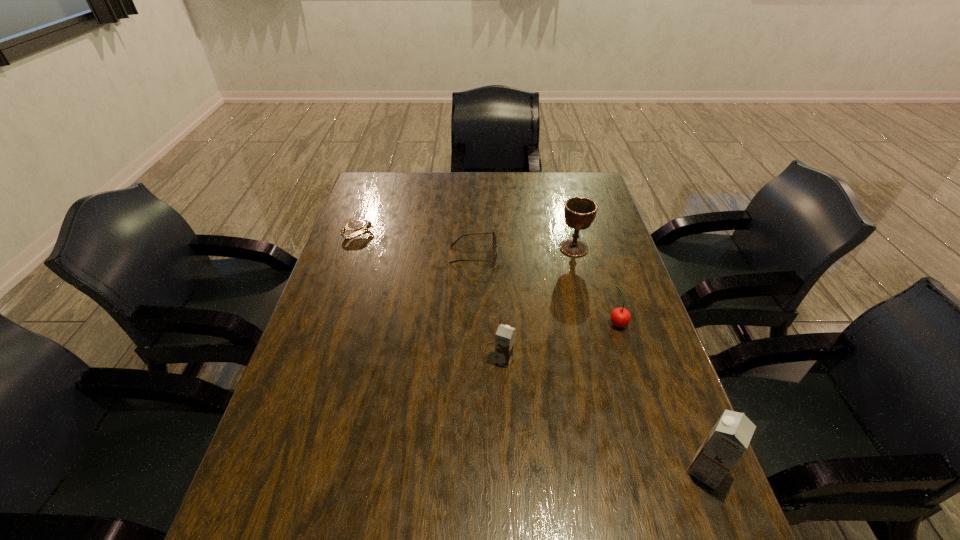
This screenshot has width=960, height=540. What are the coordinates of `vacant space situated on the back of the nearest object` in the screenshot? It's located at (664, 363).

You are a GUI agent. You are given a task and a screenshot of the screen. Output one action in this format:
    pyautogui.click(x=<x>, y=<y>)
    Task: Click on the free space located on the back of the chalice
    The image size is (960, 540).
    Given the screenshot: What is the action you would take?
    pyautogui.click(x=559, y=190)

Locate an element on the screen. vacant space situated on the front-facing side of the sunglasses is located at coordinates click(529, 255).

The image size is (960, 540). I want to click on free point located 0.380m on the back of the third nearest object, so click(589, 233).

Locate an element on the screen. The width and height of the screenshot is (960, 540). vacant space located on the front of the shortest object is located at coordinates (324, 331).

At what (x,y) coordinates should I click in order to perform the action: click on object present at the near edge. Please return your answer as a coordinate pair (x, y). Looking at the image, I should click on (728, 440).

At what (x,y) coordinates should I click in order to perform the action: click on object situated at the left edge. Please return your answer as a coordinate pair (x, y). Looking at the image, I should click on (355, 225).

Where is `chocolate milk located at the right edge`? The height and width of the screenshot is (540, 960). chocolate milk located at the right edge is located at coordinates (728, 440).

Locate an element on the screen. This screenshot has width=960, height=540. chalice that is at the right edge is located at coordinates (579, 212).

I want to click on cherry that is at the right edge, so click(620, 317).